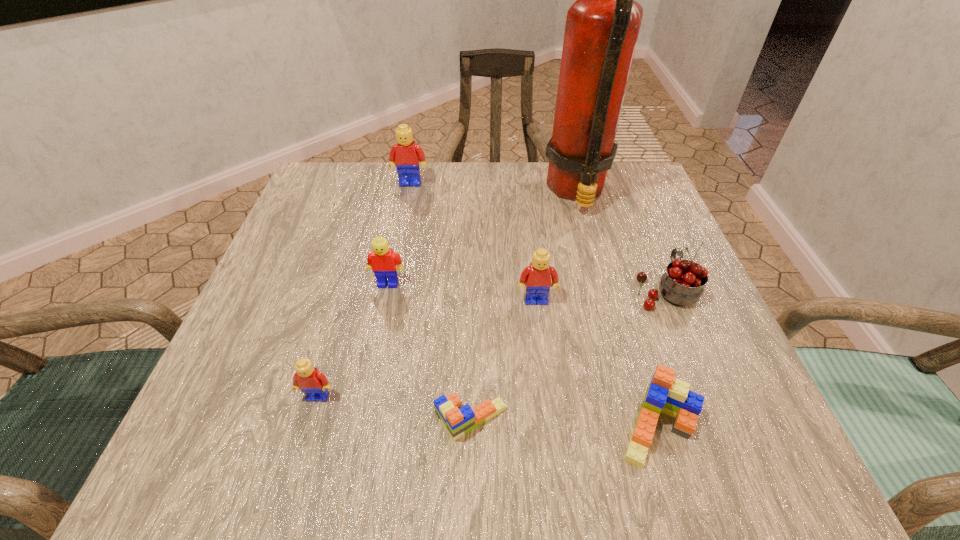
Identify the location of the tallest object. (602, 26).

Locate an element on the screen. The image size is (960, 540). fire extinguisher is located at coordinates (602, 26).

Where is `the biggest yellow Lego`? The height and width of the screenshot is (540, 960). the biggest yellow Lego is located at coordinates (405, 155).

You are a GUI agent. You are given a task and a screenshot of the screen. Output one action in this format:
    pyautogui.click(x=<x>, y=<y>)
    Task: Click on the seventh shortest object
    The image size is (960, 540).
    Given the screenshot: What is the action you would take?
    pyautogui.click(x=405, y=155)

At what (x,y) coordinates should I click in order to perform the action: click on the rightmost yellow Lego. Please return your answer as a coordinate pair (x, y). Looking at the image, I should click on (536, 278).

Where is `the fifth object from left to right`? The width and height of the screenshot is (960, 540). the fifth object from left to right is located at coordinates (536, 278).

Where is `the second farthest yellow Lego`? the second farthest yellow Lego is located at coordinates (382, 260).

Find the location of a particular element. red cherry is located at coordinates (682, 284).

The height and width of the screenshot is (540, 960). I want to click on the third shortest object, so click(314, 384).

Identify the location of the leftmost Lego. tap(314, 384).